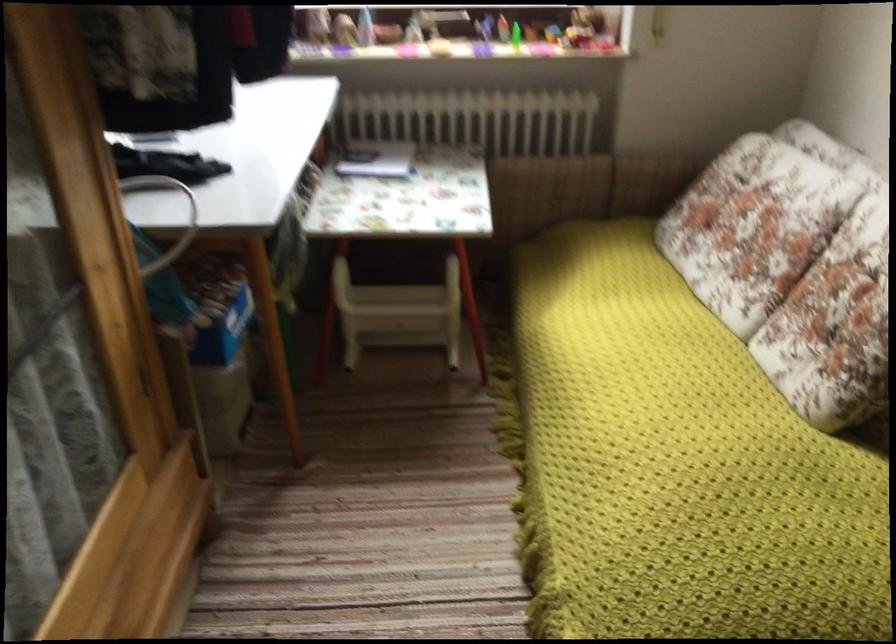
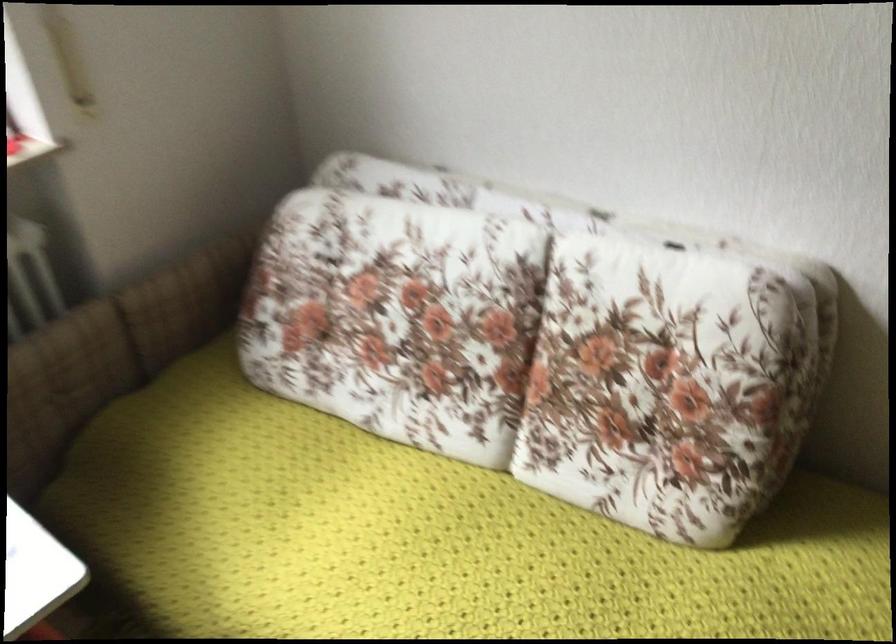
The point at (807, 270) is marked in the first image. Where is the corresponding point in the second image?

(530, 354)